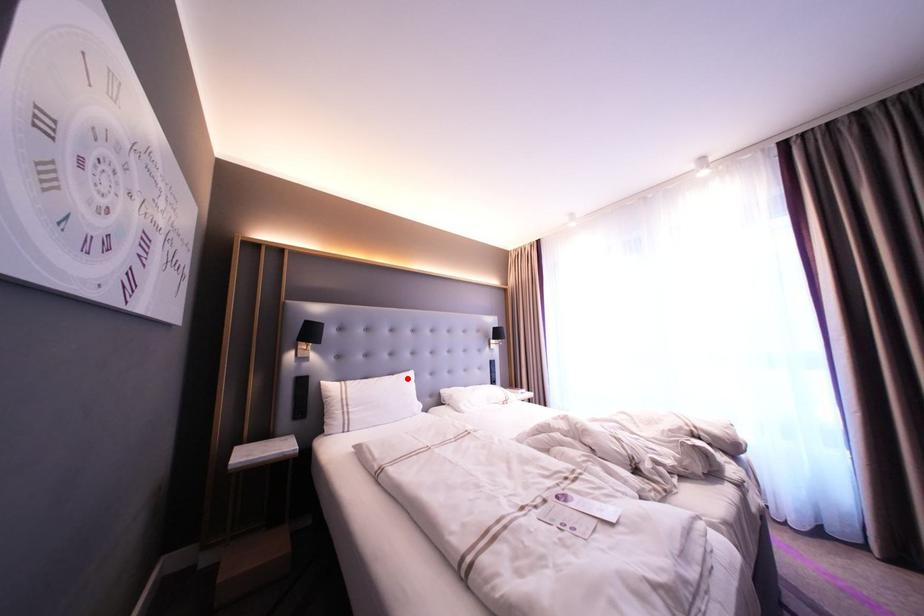
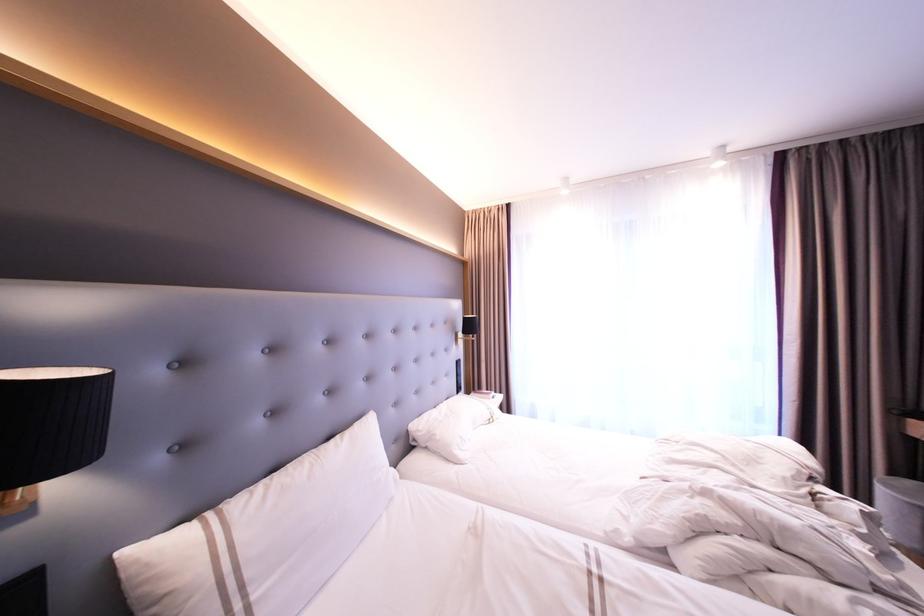
Question: I am providing you with two images of the same scene from different viewpoints. Given a red point in image1, look at the same physical point in image2. Is it:

Choices:
 (A) Closer to the viewpoint
 (B) Farther from the viewpoint

Answer: (A)